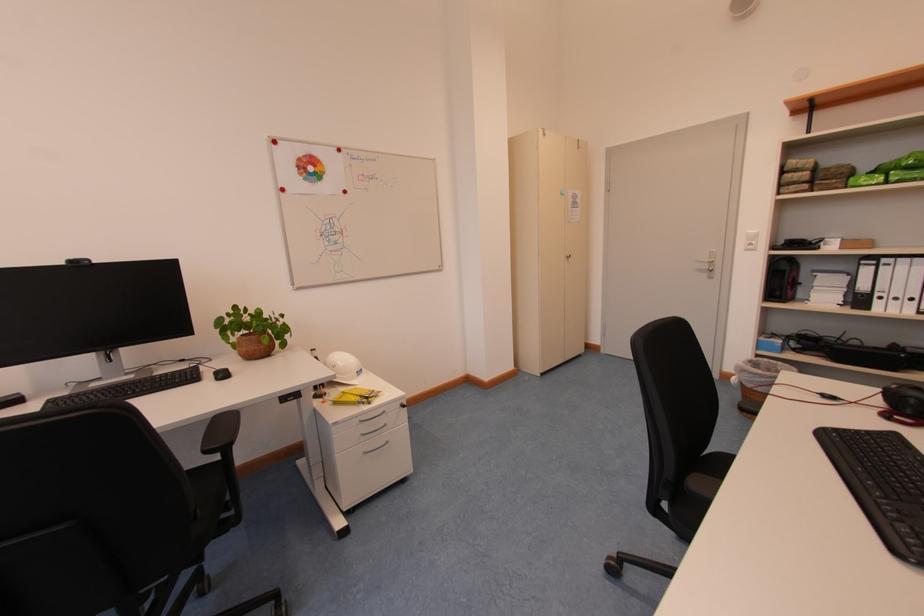
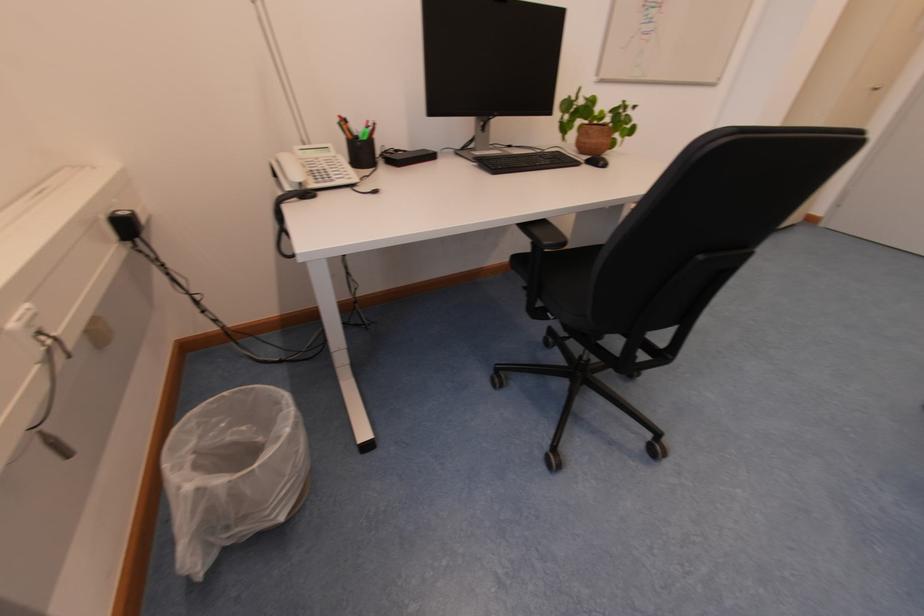
Question: In a continuous first-person perspective shot, in which direction is the camera moving?

Choices:
 (A) Left
 (B) Right
 (C) Forward
 (D) Backward

Answer: (A)